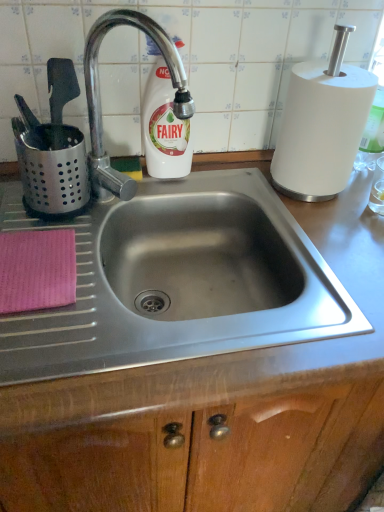
You are a GUI agent. You are given a task and a screenshot of the screen. Output one action in this format:
    pyautogui.click(x=<x>, y=<y>)
    Task: Click on the vacant area that is in front of white matte paper towel at upper right
    Image resolution: width=384 pixels, height=512 pixels.
    Given the screenshot: What is the action you would take?
    pyautogui.click(x=329, y=225)